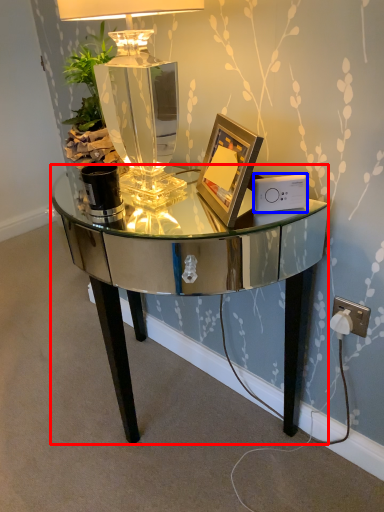
Question: Which object is further to the camera taking this photo, desk (highlighted by a red box) or ipod (highlighted by a blue box)?

Choices:
 (A) desk
 (B) ipod

Answer: (B)